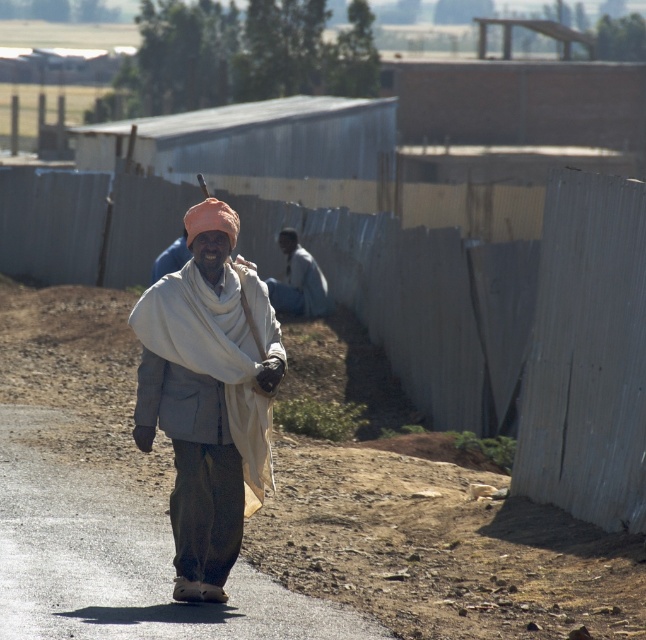
You are a fashion designer observing the man in the scene. You need to determine which fabric item on his head is taller between the light brown fabric turban at center and the dark gray fabric at center. Which one is taller?

The light brown fabric turban at center is taller than the dark gray fabric at center.

You are standing at the point labeled point (307,266) and want to walk to the point labeled point (145,349). Which direction should you move relative to your current position?

You should move towards the direction closer to the camera since point (145,349) is closer to the camera than point (307,266).

You are a photographer trying to capture the man in the scene. You want to focus on the light brown fabric turban at center and the dark gray fabric at center. Which fabric should you adjust your camera focus on first to ensure both are in focus?

The light brown fabric turban at center is closer to the viewer than the dark gray fabric at center, so you should focus on the light brown fabric turban at center first to ensure both are in focus.